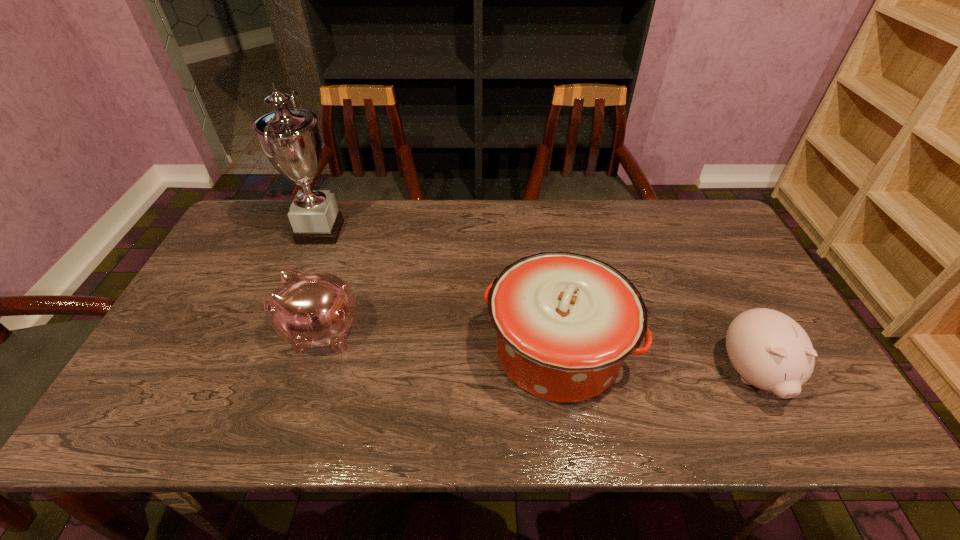
Locate an element on the screen. the tallest object is located at coordinates (290, 138).

Locate an element on the screen. trophy cup is located at coordinates (290, 138).

You are a GUI agent. You are given a task and a screenshot of the screen. Output one action in this format:
    pyautogui.click(x=<x>, y=<y>)
    Task: Click on the second object from right to left
    
    Given the screenshot: What is the action you would take?
    pyautogui.click(x=565, y=322)

I want to click on the left piggy bank, so click(309, 309).

Where is `the rightmost object`? Image resolution: width=960 pixels, height=540 pixels. the rightmost object is located at coordinates (770, 350).

This screenshot has width=960, height=540. Find the location of `vacant space situated at the front view of the trophy cup`. vacant space situated at the front view of the trophy cup is located at coordinates (373, 232).

Where is `free space located 0.320m on the left of the casserole`? free space located 0.320m on the left of the casserole is located at coordinates (355, 351).

At what (x,y) coordinates should I click in order to perform the action: click on vacant space located 0.100m on the front facing side of the left piggy bank. Please return your answer as a coordinate pair (x, y). This screenshot has height=540, width=960. Looking at the image, I should click on (241, 333).

At what (x,y) coordinates should I click in order to perform the action: click on free space located on the front facing side of the left piggy bank. Please return your answer as a coordinate pair (x, y). Looking at the image, I should click on (245, 333).

The height and width of the screenshot is (540, 960). Identify the location of vacant position located on the front facing side of the left piggy bank. (241, 333).